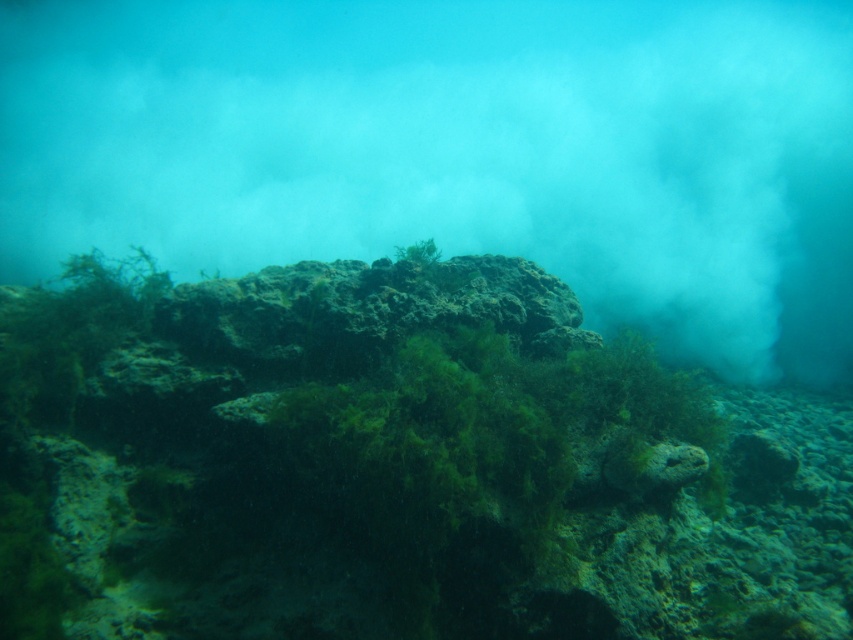
Question: Can you confirm if green algae-covered rock at center is thinner than translucent fog at center?

Choices:
 (A) no
 (B) yes

Answer: (B)

Question: Does green algae-covered rock at center appear on the right side of translucent fog at center?

Choices:
 (A) yes
 (B) no

Answer: (A)

Question: Which point is closer to the camera taking this photo?

Choices:
 (A) (183, 145)
 (B) (109, 365)

Answer: (B)

Question: Can you confirm if green algae-covered rock at center is smaller than translucent fog at center?

Choices:
 (A) no
 (B) yes

Answer: (A)

Question: Which point is closer to the camera taking this photo?

Choices:
 (A) (451, 564)
 (B) (495, 163)

Answer: (A)